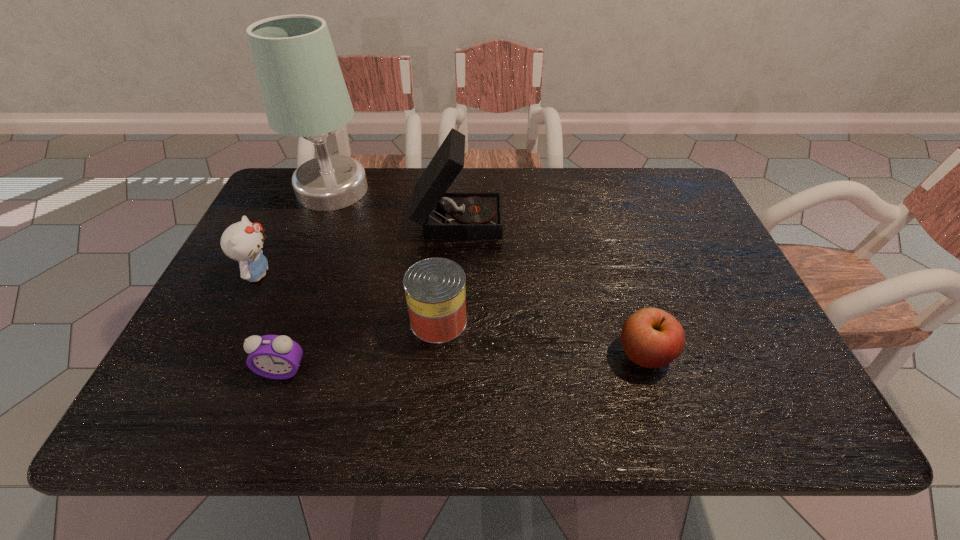
Where is `lampshade`? The image size is (960, 540). lampshade is located at coordinates (304, 93).

This screenshot has width=960, height=540. In order to click on the second tallest object in this screenshot , I will do `click(442, 215)`.

Find the location of `kitten`. kitten is located at coordinates (242, 241).

The image size is (960, 540). In order to click on can in this screenshot , I will do `click(435, 291)`.

Locate an element on the screen. apple is located at coordinates (652, 338).

You are a GUI agent. You are given a task and a screenshot of the screen. Output one action in this format:
    pyautogui.click(x=<x>, y=<y>)
    Task: Click on the alarm clock
    
    Given the screenshot: What is the action you would take?
    pyautogui.click(x=272, y=356)

At what (x,y) coordinates should I click in order to perform the action: click on vacant region located on the base of the lampshade. Please return your answer as a coordinate pair (x, y). Looking at the image, I should click on 310,245.

Identify the location of vacant point located 0.330m on the front-facing side of the fifth shortest object. click(x=619, y=218).

You are a GUI agent. You are given a task and a screenshot of the screen. Output one action in this format:
    pyautogui.click(x=<x>, y=<y>)
    Task: Click on the vacant space situated on the front-facing side of the third farthest object
    This screenshot has height=540, width=960.
    Given the screenshot: What is the action you would take?
    pyautogui.click(x=297, y=274)

Identify the location of free point located on the front of the can. (433, 390).